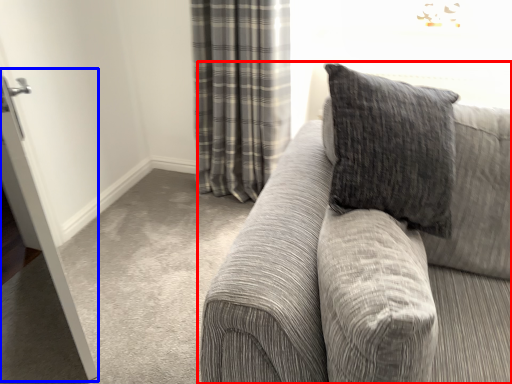
Question: Which object is closer to the camera taking this photo, studio couch (highlighted by a red box) or screen door (highlighted by a blue box)?

Choices:
 (A) studio couch
 (B) screen door

Answer: (A)